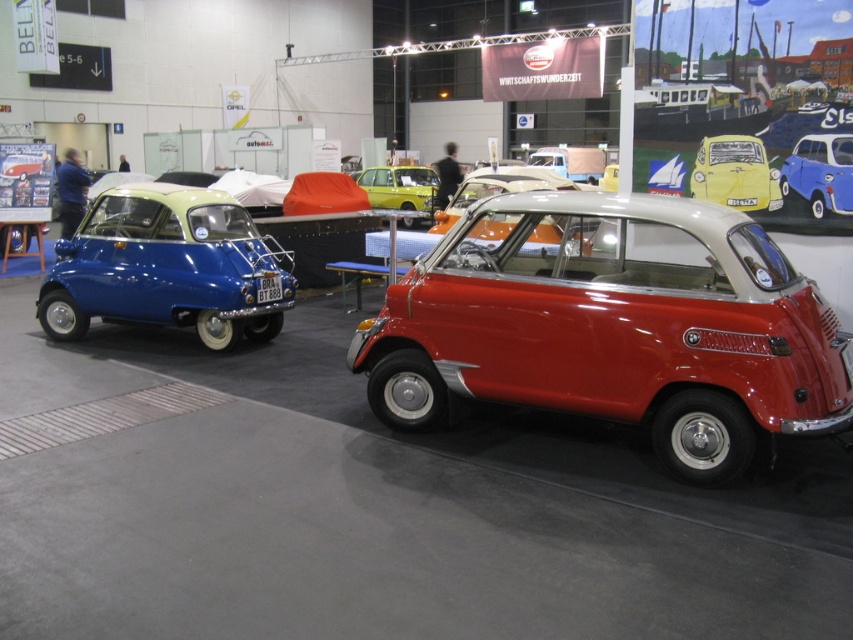
Does metallic red car at center appear over metallic silver car at center?

Actually, metallic red car at center is below metallic silver car at center.

Can you confirm if metallic red car at center is thinner than metallic silver car at center?

Yes, metallic red car at center is thinner than metallic silver car at center.

Does point (505, 396) come farther from viewer compared to point (438, 214)?

No, (505, 396) is closer to viewer.

In order to click on metallic red car at center in this screenshot , I will do `click(613, 326)`.

Which is below, blue matte car at center or metallic silver car at center?

Positioned lower is blue matte car at center.

Is blue matte car at center behind metallic silver car at center?

Yes, blue matte car at center is behind metallic silver car at center.

Find the location of a particular element. This screenshot has height=640, width=853. blue matte car at center is located at coordinates (820, 173).

Who is shorter, yellow matte car at upper right or blue matte car at center?

Standing shorter between the two is blue matte car at center.

This screenshot has height=640, width=853. Identify the location of yellow matte car at upper right. (735, 173).